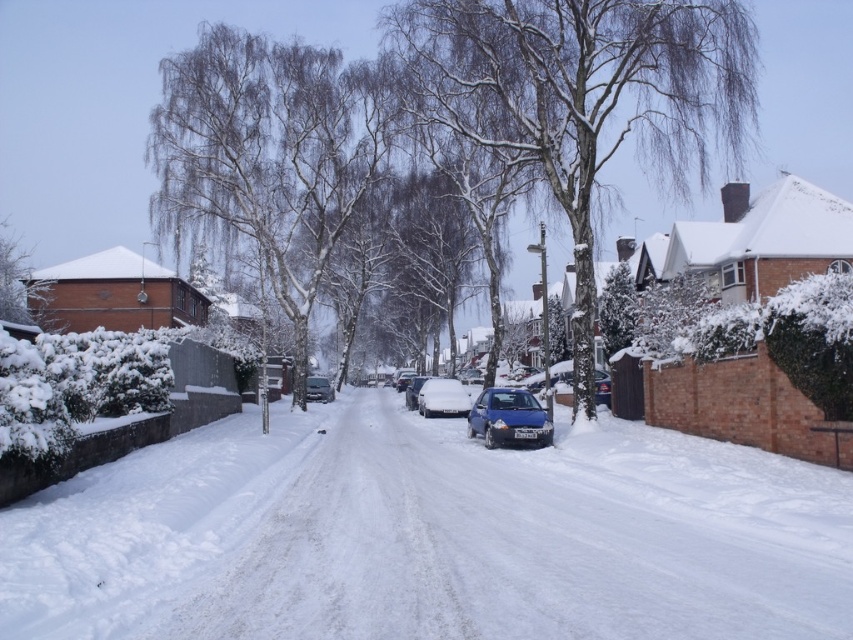
You are a delivery driver who needs to park your vehicle in a narrow alley that can only accommodate cars with a width of 1.8 meters. You see a metallic blue hatchback at center and a blue metallic car at center in the scene. Which vehicle should you choose to park in the alley?

The metallic blue hatchback at center has a lesser width compared to the blue metallic car at center, so you should choose the metallic blue hatchback at center to park in the alley since it is narrower and fits within the 1.8 meters width requirement.

You are a pedestrian standing on the sidewalk and see both the metallic blue hatchback at center and the blue metallic car at center. Which one is positioned more to the right side of the street?

The metallic blue hatchback at center is positioned more to the right side of the street than the blue metallic car at center.